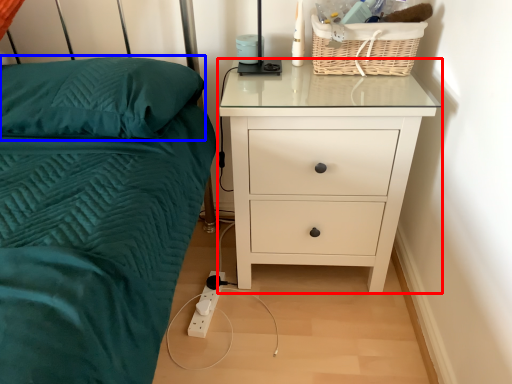
Question: Among these objects, which one is nearest to the camera, chest of drawers (highlighted by a red box) or pillow (highlighted by a blue box)?

Choices:
 (A) chest of drawers
 (B) pillow

Answer: (B)